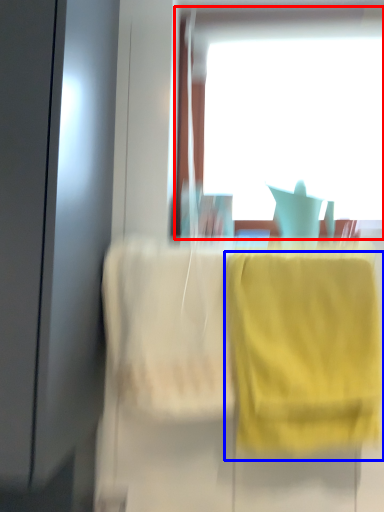
Question: Which of the following is the farthest to the observer, window (highlighted by a red box) or towel/napkin (highlighted by a blue box)?

Choices:
 (A) window
 (B) towel/napkin

Answer: (A)